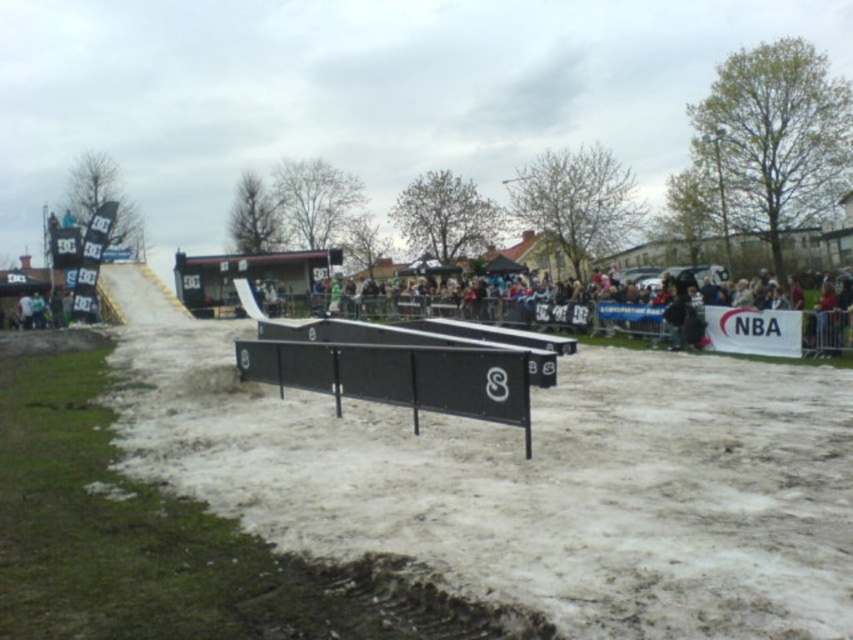
Is brown dirt track at lower left shorter than black matte ramp at center?

Yes, brown dirt track at lower left is shorter than black matte ramp at center.

Describe the element at coordinates (531, 483) in the screenshot. The height and width of the screenshot is (640, 853). I see `brown dirt track at lower left` at that location.

Who is more forward, (219,369) or (502,323)?

Point (219,369) is in front.

Find the location of `brown dirt track at lower left`. brown dirt track at lower left is located at coordinates (531, 483).